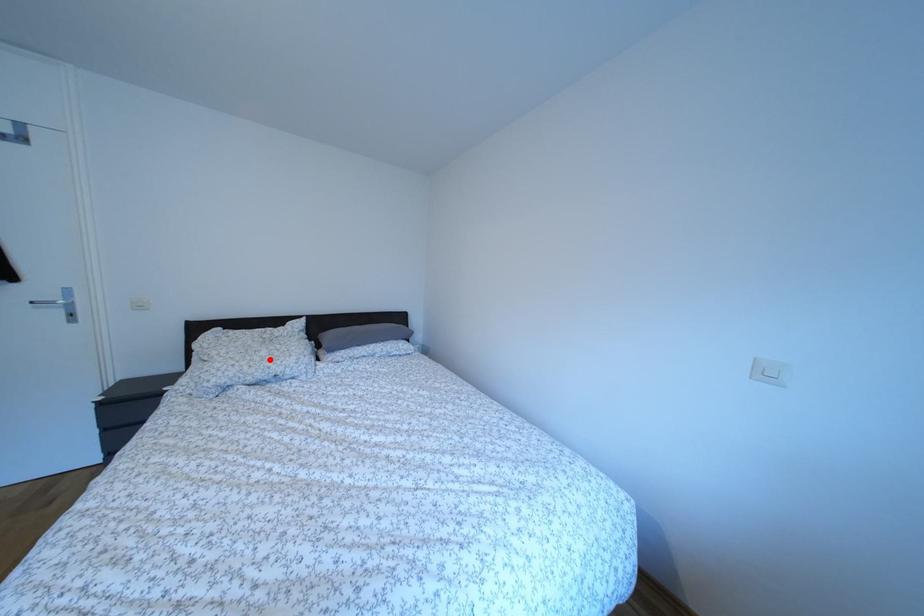
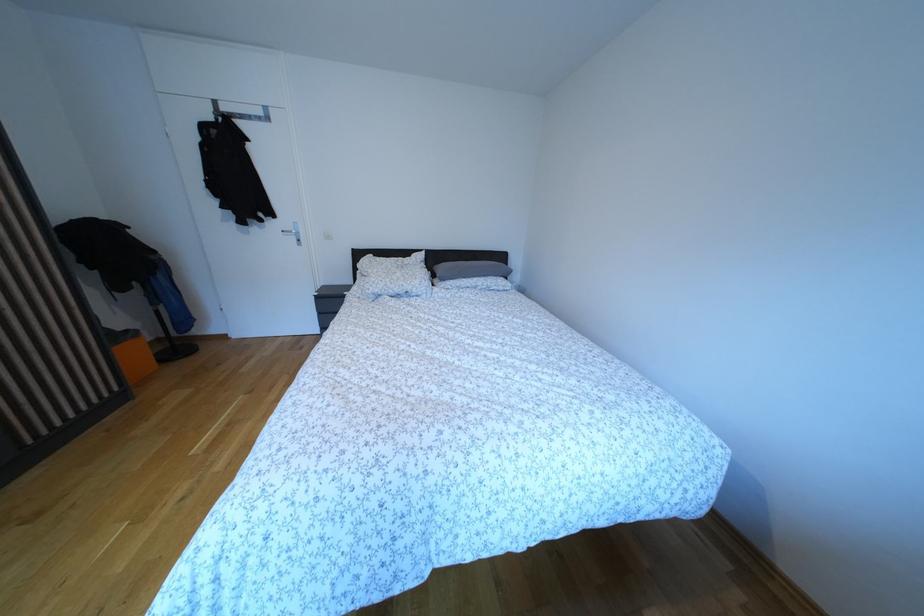
Locate, in the second image, the point that corresponds to the highlighted location in the first image.

(406, 281)